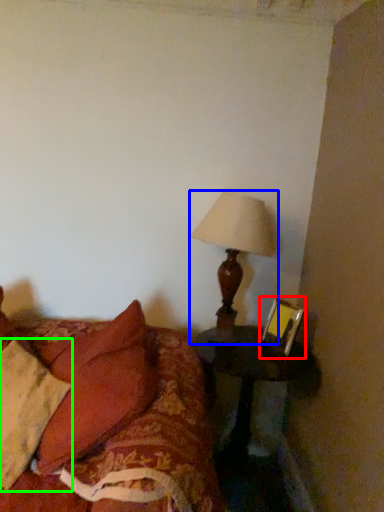
Question: Which object is the farthest from picture frame (highlighted by a red box)? Choose among these: lamp (highlighted by a blue box) or pillow (highlighted by a green box).

Choices:
 (A) lamp
 (B) pillow

Answer: (B)